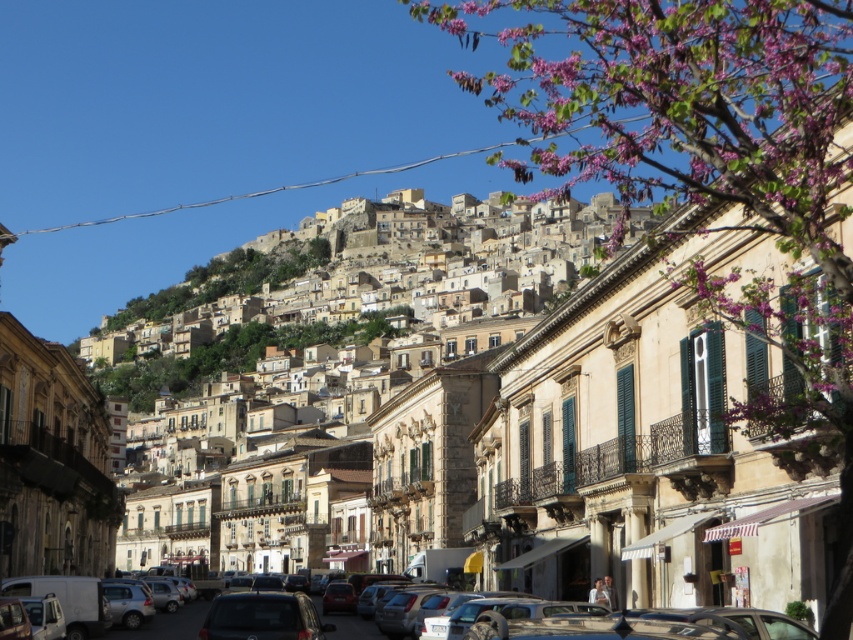
Question: Does beige stone buildings at center lie behind matte silver car at lower center?

Choices:
 (A) yes
 (B) no

Answer: (A)

Question: Can you confirm if dark gray metallic car at center is positioned to the left of matte silver car at lower center?

Choices:
 (A) no
 (B) yes

Answer: (A)

Question: Can you confirm if beige stone buildings at center is positioned below dark gray metallic car at center?

Choices:
 (A) yes
 (B) no

Answer: (B)

Question: Estimate the real-world distances between objects in this image. Which object is farther from the beige stone buildings at center?

Choices:
 (A) dark gray metallic car at center
 (B) matte silver car at lower center

Answer: (A)

Question: Considering the real-world distances, which object is closest to the dark gray metallic car at center?

Choices:
 (A) matte silver car at lower center
 (B) beige stone buildings at center

Answer: (A)

Question: Which of the following is the closest to the observer?

Choices:
 (A) beige stone buildings at center
 (B) dark gray metallic car at center
 (C) matte silver car at lower center

Answer: (C)